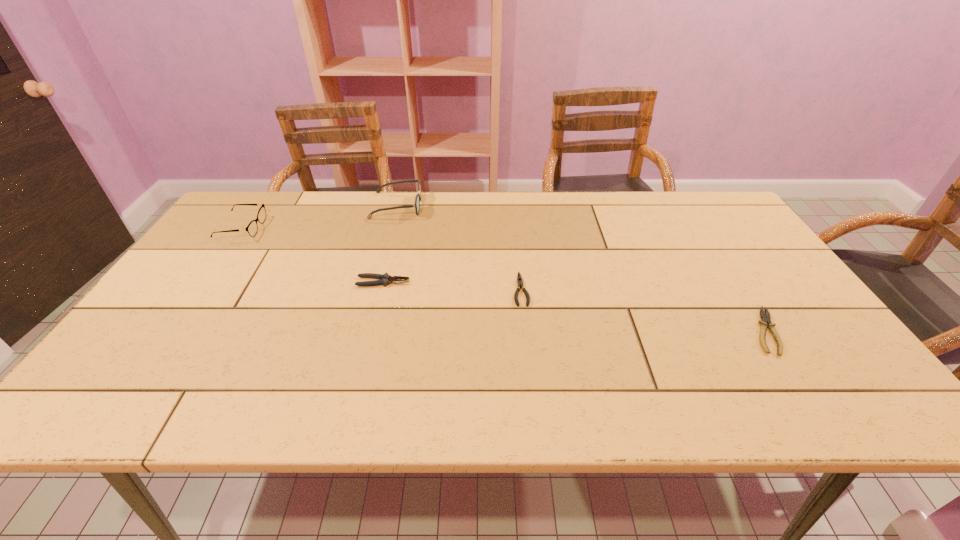
Identify the location of free space located on the front-facing side of the leftmost object. The width and height of the screenshot is (960, 540). (390, 228).

This screenshot has width=960, height=540. In order to click on blank space located 0.300m at the gripping part of the tallest pliers in this screenshot , I will do `click(522, 282)`.

The image size is (960, 540). In order to click on vacant area situated on the left of the second pliers from left to right in this screenshot , I will do `click(491, 289)`.

The height and width of the screenshot is (540, 960). Find the location of `vacant area situated 0.260m on the left of the nearest pliers`. vacant area situated 0.260m on the left of the nearest pliers is located at coordinates (x=641, y=332).

You are a GUI agent. You are given a task and a screenshot of the screen. Output one action in this format:
    pyautogui.click(x=<x>, y=<y>)
    Task: Click on the object that is at the left edge
    Image resolution: width=960 pixels, height=540 pixels.
    Given the screenshot: What is the action you would take?
    pyautogui.click(x=252, y=228)

I want to click on object that is positioned at the right edge, so click(x=765, y=316).

You are a GUI agent. You are given a task and a screenshot of the screen. Output one action in this format:
    pyautogui.click(x=<x>, y=<y>)
    Task: Click on the object at the far left corner
    
    Given the screenshot: What is the action you would take?
    pyautogui.click(x=252, y=228)

In the image, there is a desktop. Where is `free space at the far edge`? free space at the far edge is located at coordinates (554, 211).

Locate an element on the screen. The image size is (960, 540). blank space at the near edge of the desktop is located at coordinates (675, 392).

Identify the location of vacant area at the left edge of the desktop. This screenshot has height=540, width=960. (200, 249).